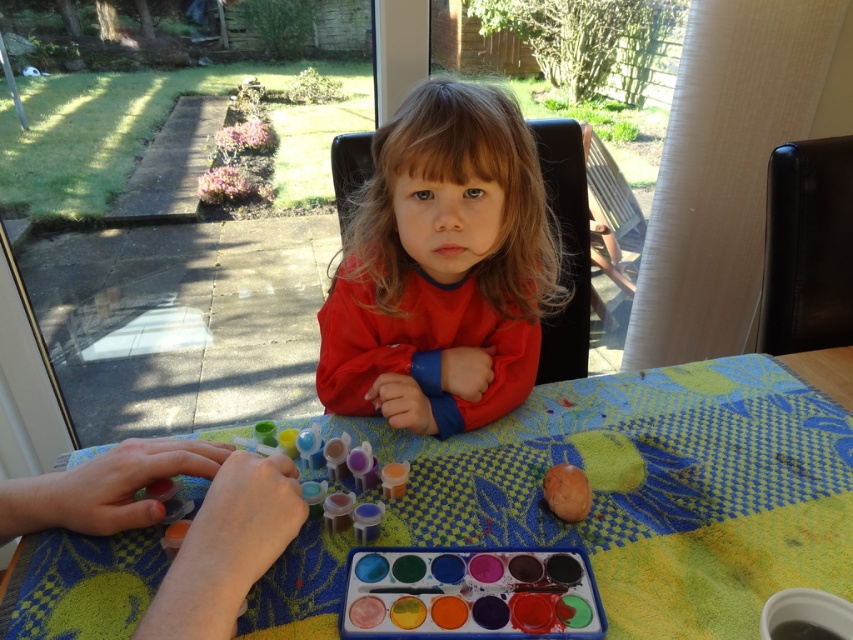
Question: Which point is farther to the camera?

Choices:
 (A) textured fabric table at center
 (B) red matte hair at center
 (C) matte brown egg at lower center
 (D) watercolor paint palette at center

Answer: (B)

Question: Which of the following is the farthest from the observer?

Choices:
 (A) watercolor paint palette at center
 (B) textured fabric table at center

Answer: (B)

Question: Which point is closer to the camera?

Choices:
 (A) (354, 588)
 (B) (584, 484)

Answer: (A)

Question: Observing the image, what is the correct spatial positioning of textured fabric table at center in reference to matte brown egg at lower center?

Choices:
 (A) left
 (B) right

Answer: (A)

Question: Is textured fabric table at center smaller than red matte hair at center?

Choices:
 (A) no
 (B) yes

Answer: (B)

Question: Is the position of red matte hair at center more distant than that of matte brown egg at lower center?

Choices:
 (A) no
 (B) yes

Answer: (B)